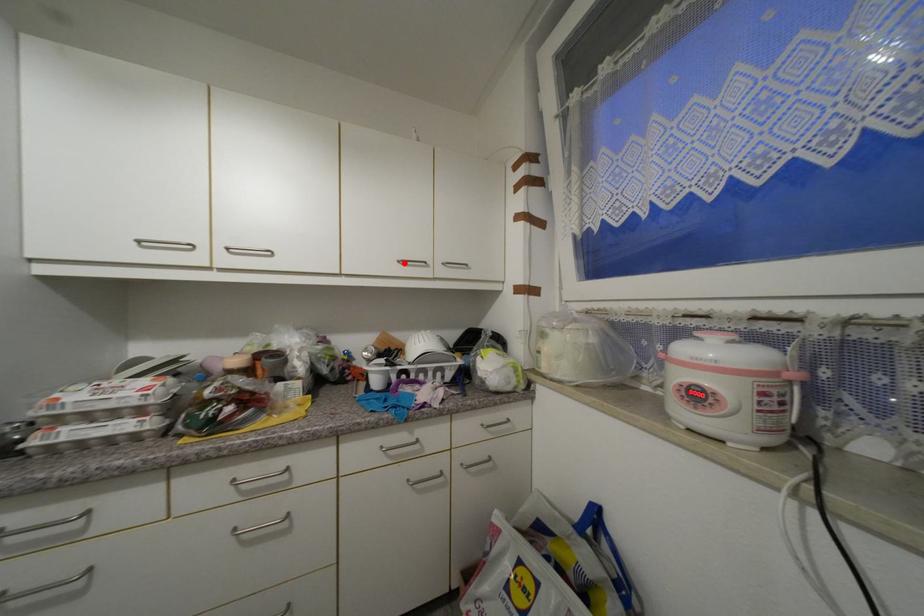
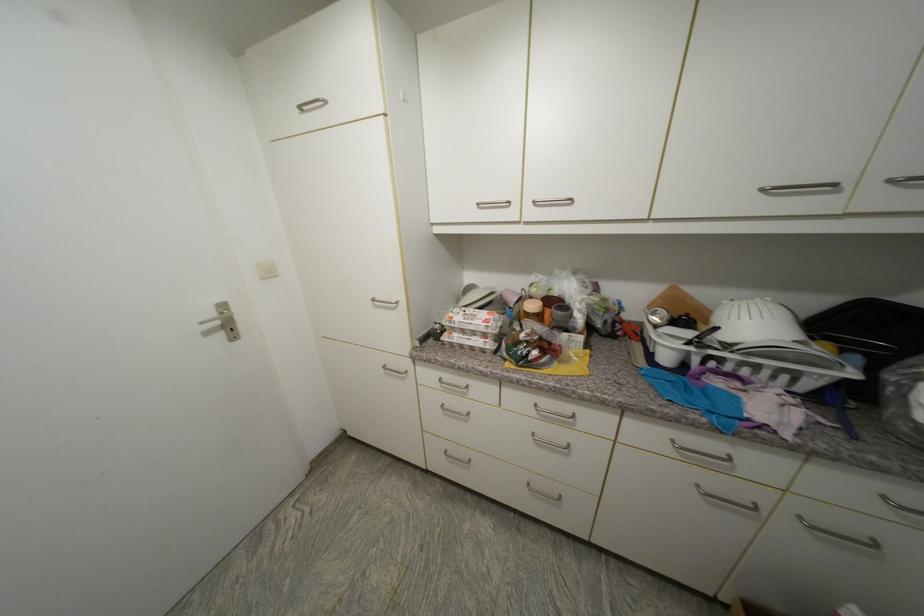
Locate, in the second image, the point that corresponds to the highlighted location in the first image.

(768, 191)